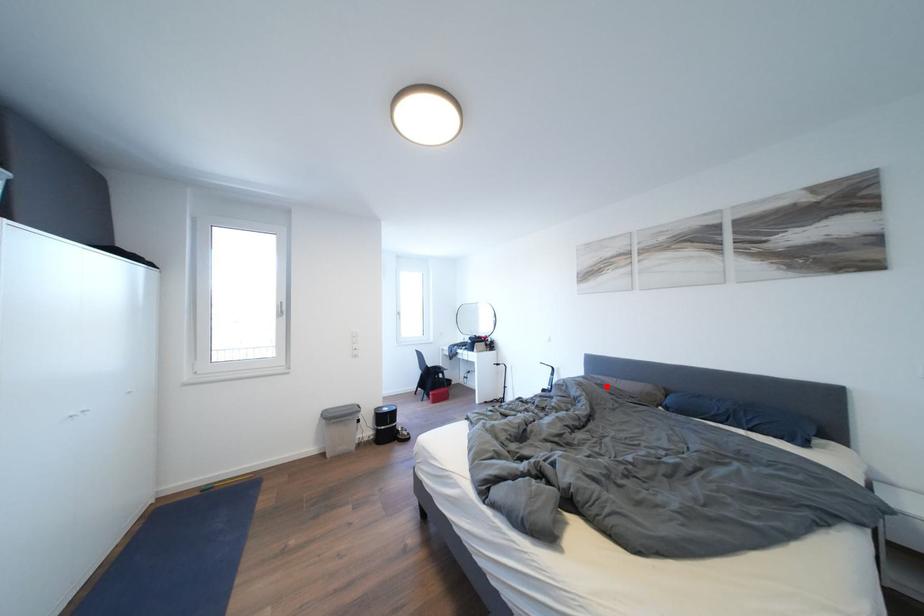
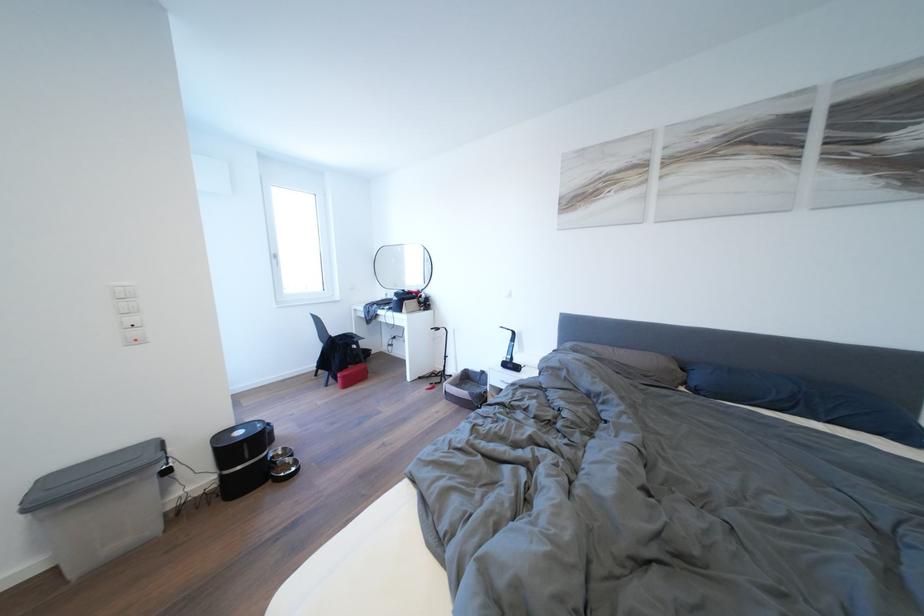
Where in the second image is the point corresponding to the highlighted location from the first image?

(602, 360)